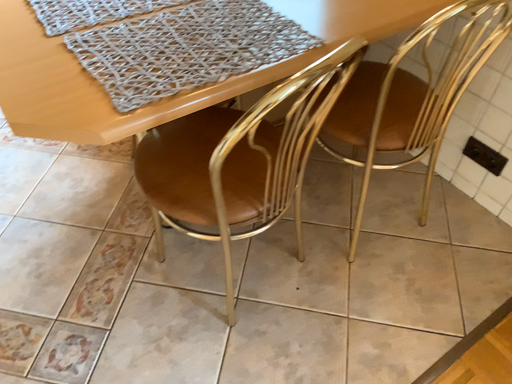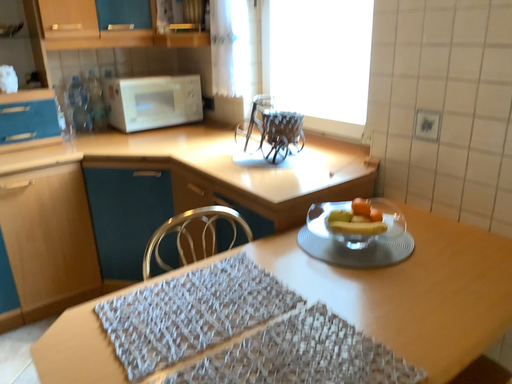
Question: Which way did the camera rotate in the video?

Choices:
 (A) rotated downward
 (B) rotated upward

Answer: (B)